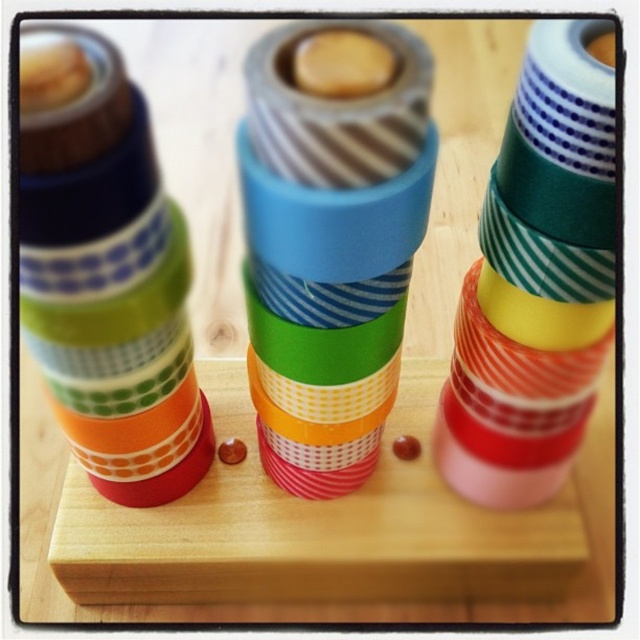
Consider the image. Does matte plastic tape at center appear over matte plastic cups at left?

No, matte plastic tape at center is not above matte plastic cups at left.

Who is taller, matte plastic tape at center or matte plastic cups at left?

matte plastic cups at left is taller.

Which is in front, point (369, 449) or point (88, 161)?

Point (88, 161) is more forward.

This screenshot has height=640, width=640. I want to click on matte plastic tape at center, so [x=330, y=244].